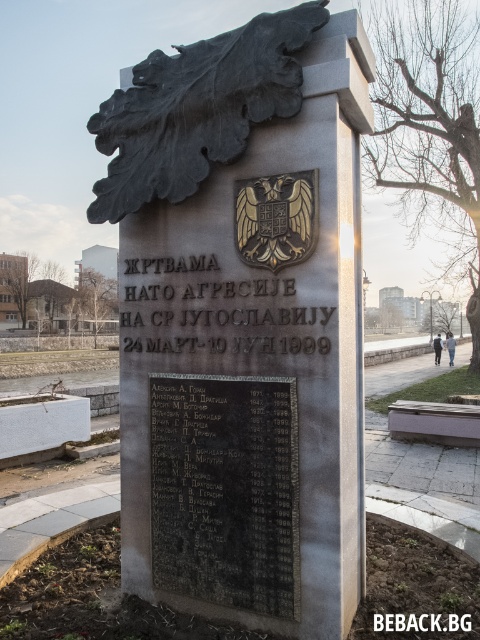
Which is behind, point (97, 204) or point (434, 337)?

Point (434, 337)

Is point (215, 474) farther from viewer compared to point (436, 353)?

That is False.

Who is more forward, (139, 310) or (439, 339)?

Point (139, 310) is more forward.

Locate an element on the screen. This screenshot has height=640, width=480. black granite monument at center is located at coordinates (242, 320).

Does black granite monument at center have a larger size compared to matte black jacket at center?

Actually, black granite monument at center might be smaller than matte black jacket at center.

Which is behind, point (303, 77) or point (453, 346)?

The point (453, 346) is more distant.

Where is `black granite monument at center`? The width and height of the screenshot is (480, 640). black granite monument at center is located at coordinates (242, 320).

Who is positioned more to the right, matte black jacket at center or black leather jacket at center?

From the viewer's perspective, matte black jacket at center appears more on the right side.

Between point (453, 348) and point (434, 352), which one is positioned in front?

Positioned in front is point (453, 348).

Where is `matte black jacket at center`? The width and height of the screenshot is (480, 640). matte black jacket at center is located at coordinates (451, 346).